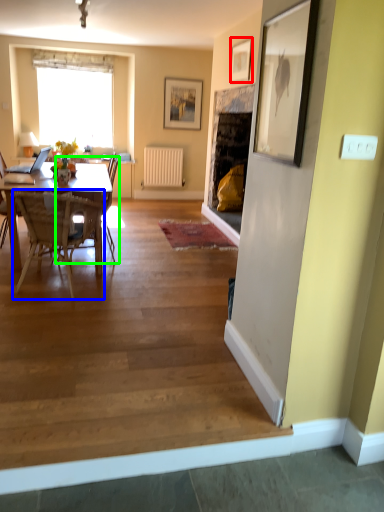
Question: Estimate the real-world distances between objects in this image. Which object is closer to picture frame (highlighted by a red box), chair (highlighted by a blue box) or chair (highlighted by a green box)?

Choices:
 (A) chair
 (B) chair

Answer: (B)